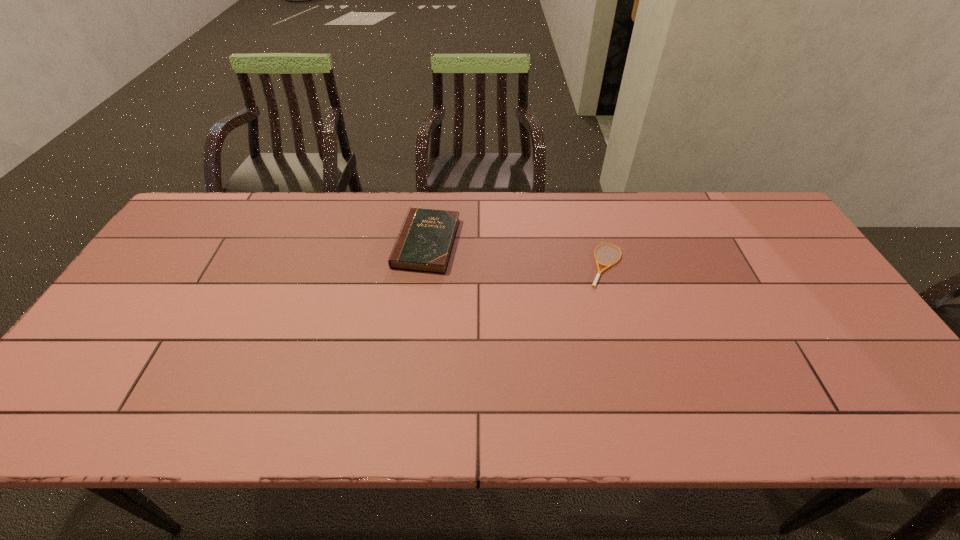
The height and width of the screenshot is (540, 960). In the image, there is a desktop. Identify the location of vacant space at the right edge. (783, 263).

The image size is (960, 540). Identify the location of free region at the near right corner of the desktop. (911, 431).

The height and width of the screenshot is (540, 960). What are the coordinates of `free region that satisfies the following two spatial constraints: 1. on the front side of the right object; 2. on the right side of the Bible` in the screenshot? It's located at (424, 265).

Where is `free space in the image that satisfies the following two spatial constraints: 1. on the front side of the tennis racket; 2. on the left side of the Bible`? The image size is (960, 540). free space in the image that satisfies the following two spatial constraints: 1. on the front side of the tennis racket; 2. on the left side of the Bible is located at coordinates coord(424,265).

This screenshot has width=960, height=540. I want to click on free spot that satisfies the following two spatial constraints: 1. on the front side of the shorter object; 2. on the right side of the taller object, so (x=424, y=265).